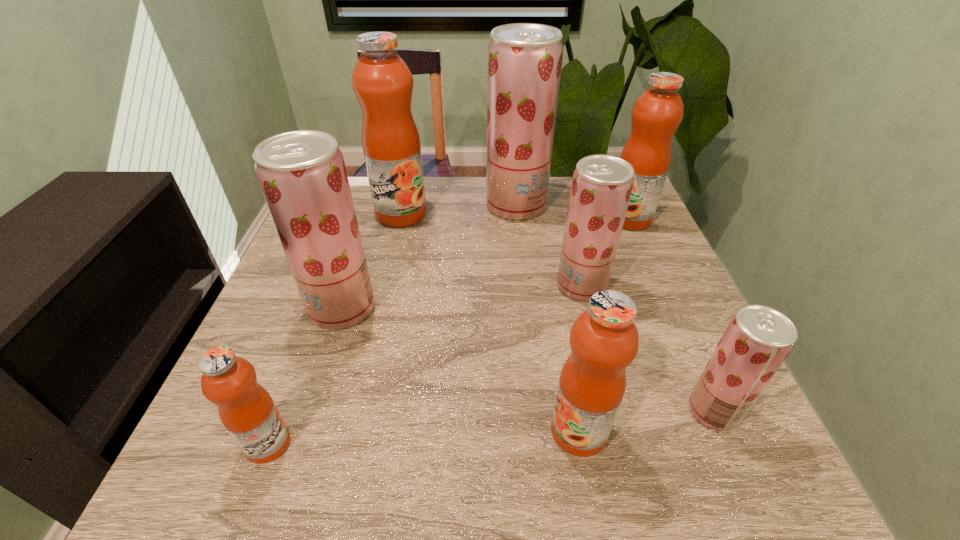
Find the location of a particular element. strawberry fruit juice that stands as the third closest to the second orange fruit juice from right to left is located at coordinates (302, 174).

Find the location of a particular element. orange fruit juice that is the third closest to the leftmost strawberry fruit juice is located at coordinates (604, 340).

Identify the location of orange fruit juice that can be found as the closest to the second orange fruit juice from right to left. The width and height of the screenshot is (960, 540). (246, 409).

Locate an element on the screen. This screenshot has height=540, width=960. vacant point that satisfies the following two spatial constraints: 1. on the front side of the third biggest strawberry fruit juice; 2. on the right side of the nearest strawberry fruit juice is located at coordinates (612, 410).